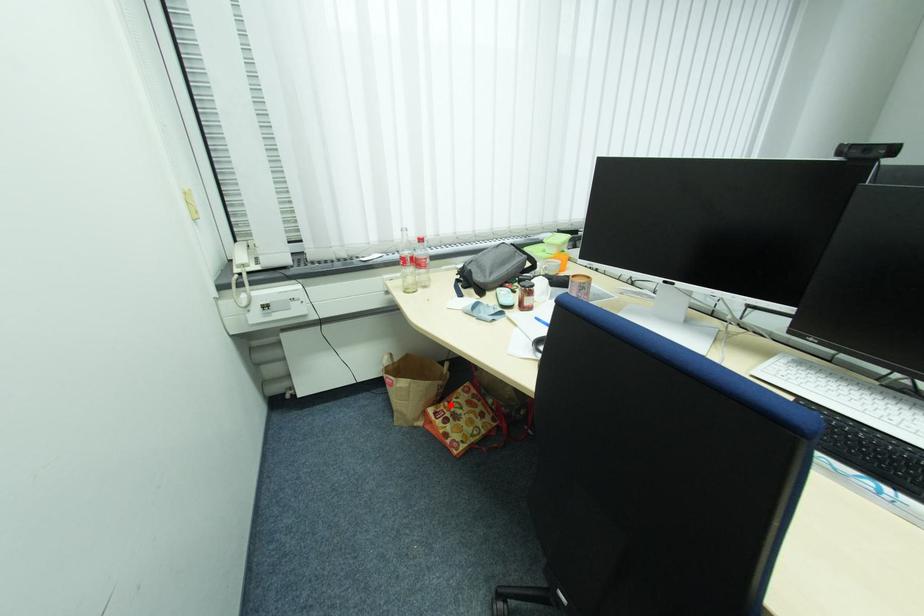
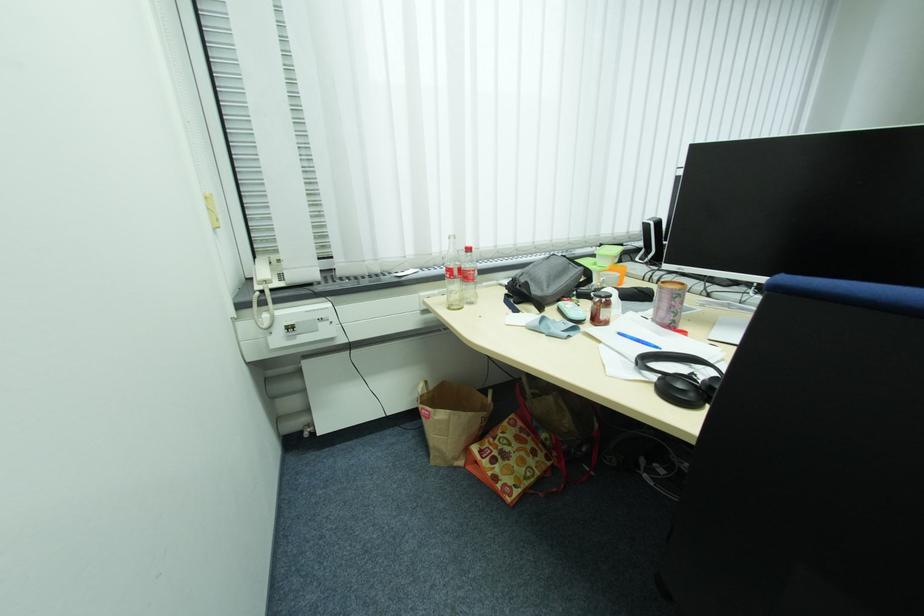
Question: I am providing you with two images of the same scene from different viewpoints. A red point is marked on the first image. Can you still see the location of the red point in image 2?

Choices:
 (A) Yes
 (B) No

Answer: (A)